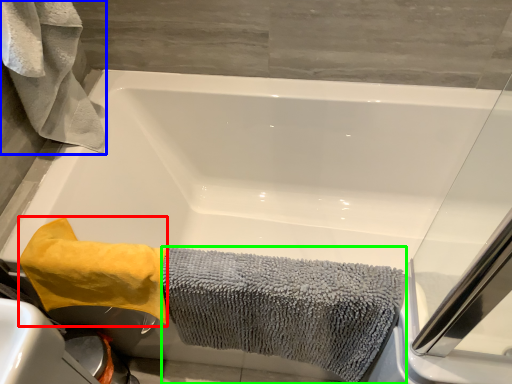
Question: Which object is positioned farthest from bath towel (highlighted by a red box)? Select from bath towel (highlighted by a blue box) and bath towel (highlighted by a green box).

Choices:
 (A) bath towel
 (B) bath towel

Answer: (A)